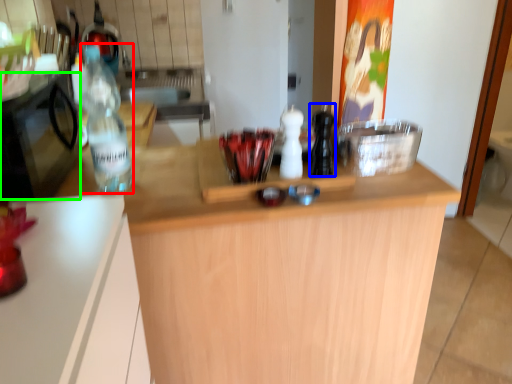
Question: Estimate the real-world distances between objects in this image. Which object is farther from bottle (highlighted by a red box), bottle (highlighted by a blue box) or appliance (highlighted by a green box)?

Choices:
 (A) bottle
 (B) appliance

Answer: (A)